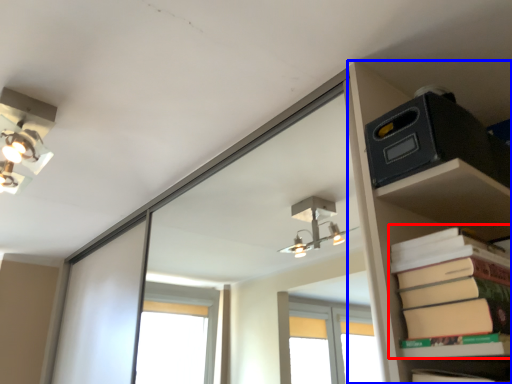
Question: Which of the following is the farthest to the observer, paperback book (highlighted by a red box) or shelf (highlighted by a blue box)?

Choices:
 (A) paperback book
 (B) shelf

Answer: (B)